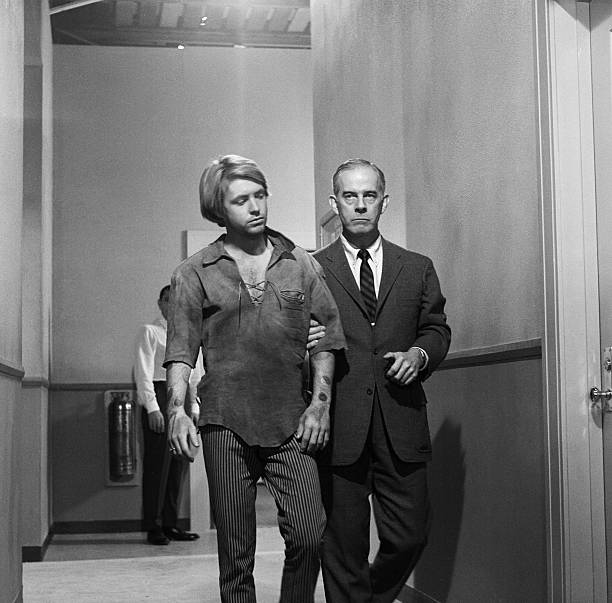
Locate an element on the screen. This screenshot has width=612, height=603. doorknob is located at coordinates (592, 398).